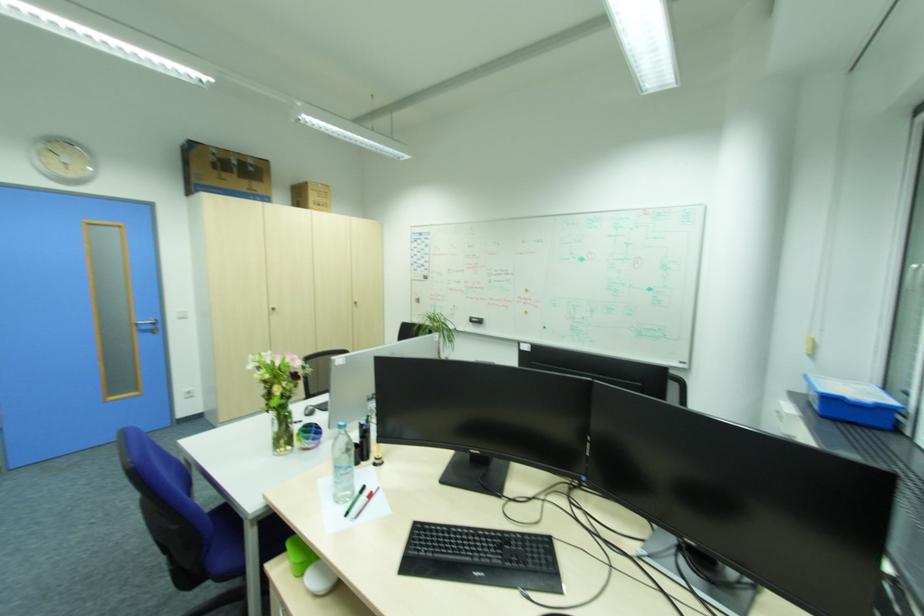
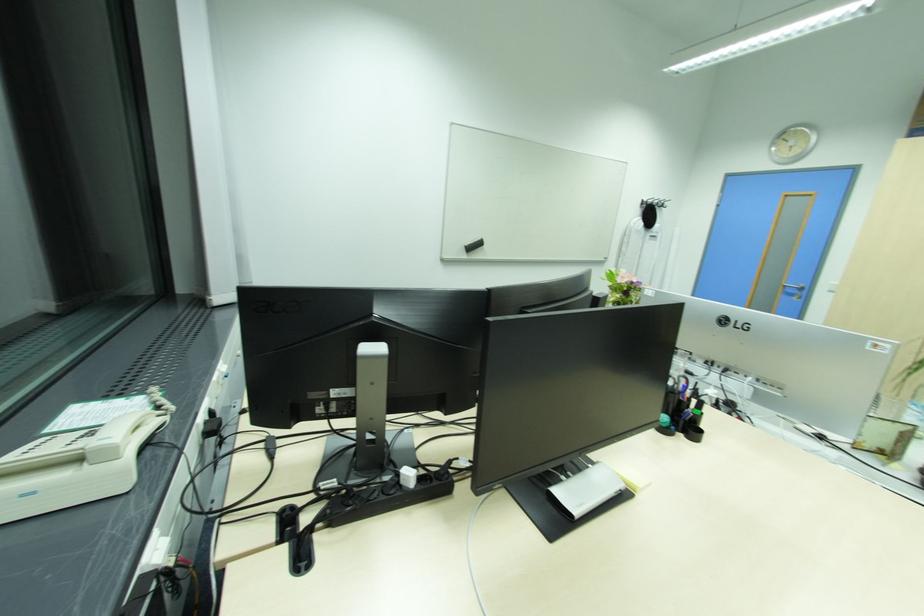
The point at (155, 326) is marked in the first image. Where is the corresponding point in the second image?

(801, 291)